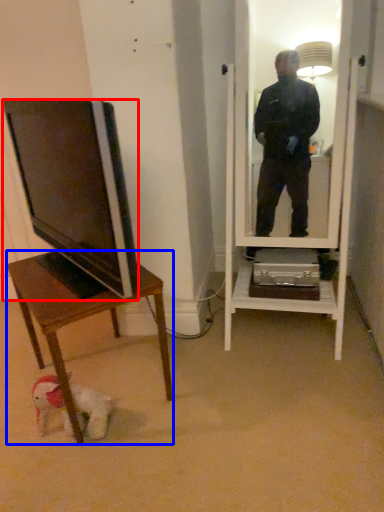
Question: Which point is closer to the camera, television (highlighted by a red box) or desk (highlighted by a blue box)?

Choices:
 (A) television
 (B) desk

Answer: (A)